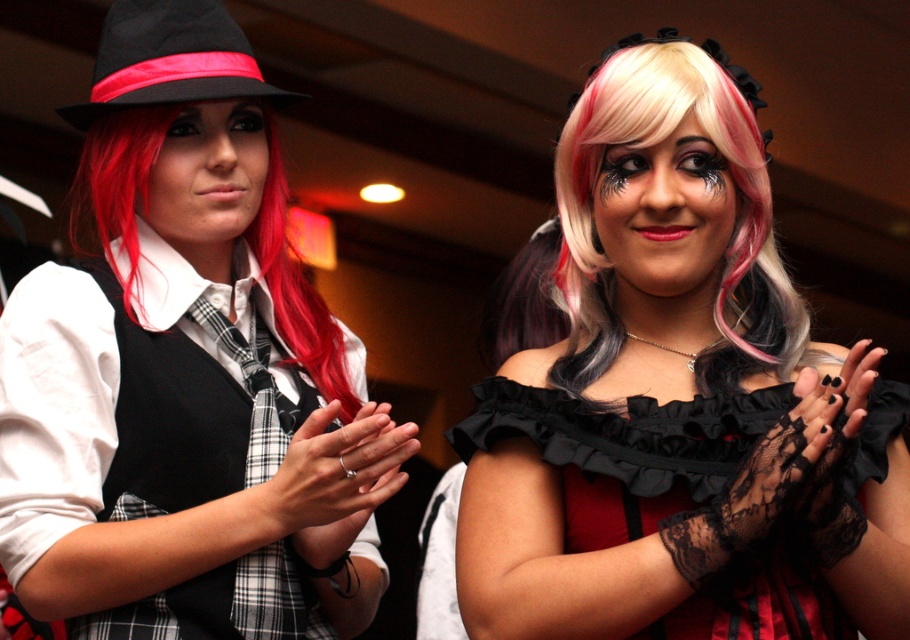
What do you see at coordinates (186, 372) in the screenshot? The height and width of the screenshot is (640, 910). I see `matte black hat at upper left` at bounding box center [186, 372].

Identify the location of matte black hat at upper left. This screenshot has width=910, height=640. (186, 372).

The image size is (910, 640). I want to click on matte black hat at upper left, so click(x=186, y=372).

Is the position of matte black hat at upper left more distant than that of blonde and pink wig at center?

No, matte black hat at upper left is in front of blonde and pink wig at center.

Which is in front, point (254, 60) or point (672, 83)?

Point (672, 83)

I want to click on matte black hat at upper left, so click(x=186, y=372).

Which is in front, point (850, 541) or point (83, 164)?

Point (850, 541)

Does point (655, 410) come closer to viewer compared to point (315, 326)?

That is True.

Is point (855, 468) positioned behind point (270, 269)?

No, it is not.

Identify the location of black lace dress at center. (703, 493).